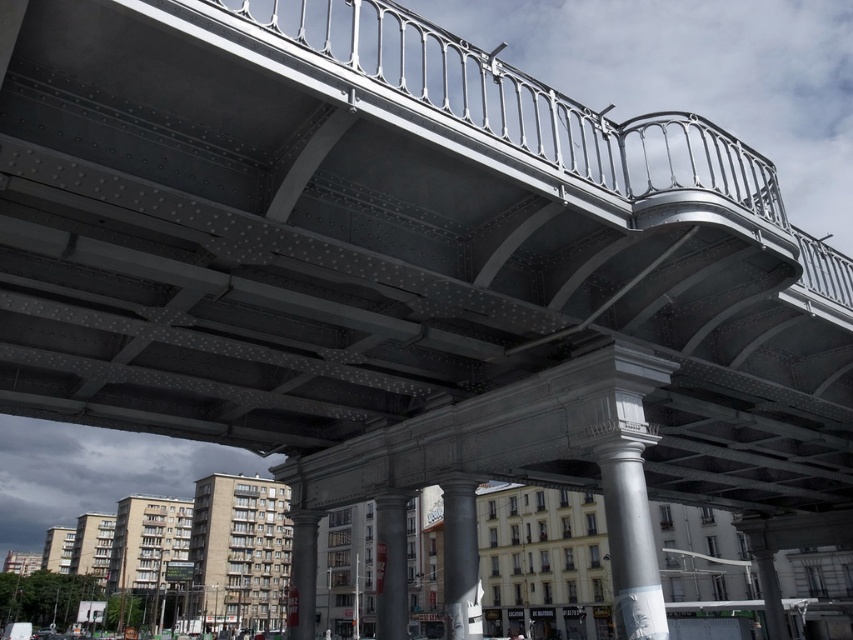
Who is lower down, white polished column at center or smooth concrete pillar at center?

Positioned lower is white polished column at center.

Is white polished column at center smaller than smooth concrete pillar at center?

Incorrect, white polished column at center is not smaller in size than smooth concrete pillar at center.

At what (x,y) coordinates should I click in order to perform the action: click on white polished column at center. Please return your answer as a coordinate pair (x, y). The width and height of the screenshot is (853, 640). Looking at the image, I should click on (630, 541).

Between white polished column at center and smooth gray pillar at center, which one is positioned lower?

Positioned lower is white polished column at center.

Is white polished column at center further to camera compared to smooth gray pillar at center?

No.

Does point (614, 488) lie in front of point (376, 518)?

Yes, it is in front of point (376, 518).

You are a GUI agent. You are given a task and a screenshot of the screen. Output one action in this format:
    pyautogui.click(x=<x>, y=<y>)
    Task: Click on the white polished column at center
    
    Given the screenshot: What is the action you would take?
    pyautogui.click(x=630, y=541)

Where is `white polished column at center`? white polished column at center is located at coordinates (630, 541).

Does white polished column at center have a lesser width compared to white polished stone column at center?

No.

Is point (602, 483) positioned after point (463, 525)?

No, (602, 483) is in front of (463, 525).

The image size is (853, 640). In order to click on white polished column at center in this screenshot , I will do `click(630, 541)`.